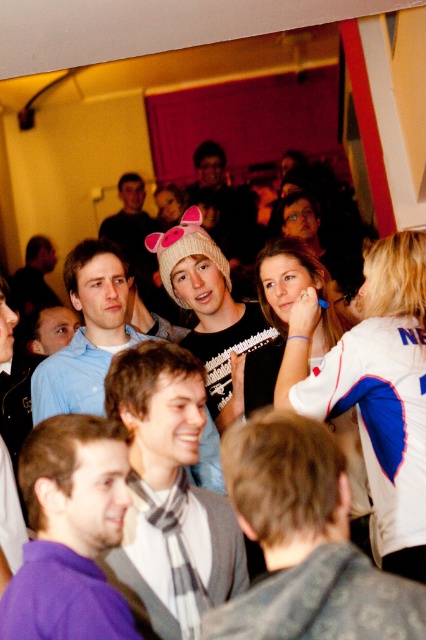
You are standing in the room and want to move from the point at coordinates point (x=307, y=621) to the point at coordinates point (x=262, y=342). Which direction should you move to reach the second point?

Since point (x=307, y=621) is in front of point (x=262, y=342), you should move backward to reach the second point.